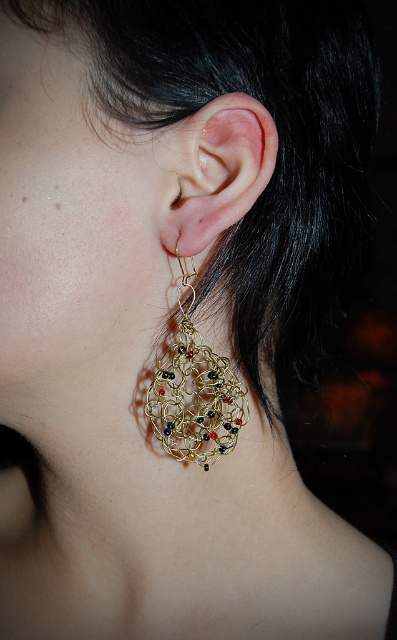
You are a jeweler who wants to place both the matte gold earring at center and the gold wire mesh earring at lower left into a display case. The display case has a shelf that can only accommodate items spaced 2.5 inches apart. Will both earrings fit on the shelf without overlapping?

The matte gold earring at center and the gold wire mesh earring at lower left are 3.08 inches apart, which exceeds the 2.5 inches spacing requirement of the shelf. Therefore, they cannot be placed on the shelf without overlapping.

You are a jeweler examining an earring collection. You notice the matte gold earring at center and the gold wire mesh earring at lower left. Which earring is closer to you according to the image?

The matte gold earring at center is closer to you because it is in front of the gold wire mesh earring at lower left.